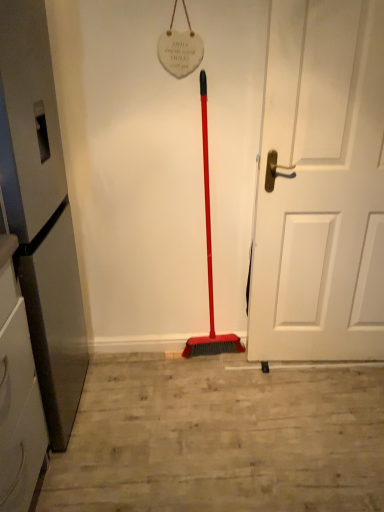
Question: Is metallic gray refrigerator at left positioned behind white matte door at center?

Choices:
 (A) no
 (B) yes

Answer: (A)

Question: Is metallic gray refrigerator at left completely or partially outside of white matte door at center?

Choices:
 (A) no
 (B) yes

Answer: (B)

Question: Can you confirm if metallic gray refrigerator at left is shorter than white matte door at center?

Choices:
 (A) yes
 (B) no

Answer: (A)

Question: Can you confirm if metallic gray refrigerator at left is positioned to the right of white matte door at center?

Choices:
 (A) yes
 (B) no

Answer: (B)

Question: Is there a large distance between metallic gray refrigerator at left and white matte door at center?

Choices:
 (A) no
 (B) yes

Answer: (A)

Question: From the image's perspective, is metallic gray refrigerator at left on white matte door at center?

Choices:
 (A) yes
 (B) no

Answer: (B)

Question: From a real-world perspective, is white matte door at center physically below metallic gray refrigerator at left?

Choices:
 (A) yes
 (B) no

Answer: (B)

Question: Is white matte door at center facing towards metallic gray refrigerator at left?

Choices:
 (A) yes
 (B) no

Answer: (B)

Question: Is white matte door at center bigger than metallic gray refrigerator at left?

Choices:
 (A) yes
 (B) no

Answer: (B)

Question: Is white matte door at center outside metallic gray refrigerator at left?

Choices:
 (A) yes
 (B) no

Answer: (A)

Question: From a real-world perspective, is white matte door at center physically above metallic gray refrigerator at left?

Choices:
 (A) no
 (B) yes

Answer: (B)

Question: Is white matte door at center shorter than metallic gray refrigerator at left?

Choices:
 (A) yes
 (B) no

Answer: (B)

Question: Would you say metallic gray refrigerator at left is to the left or to the right of white matte door at center in the picture?

Choices:
 (A) left
 (B) right

Answer: (A)